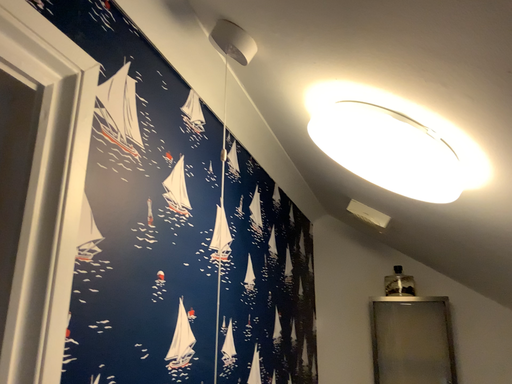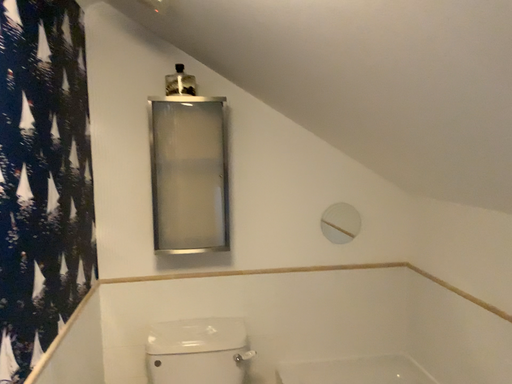
Question: Which way did the camera rotate in the video?

Choices:
 (A) rotated left
 (B) rotated right

Answer: (B)